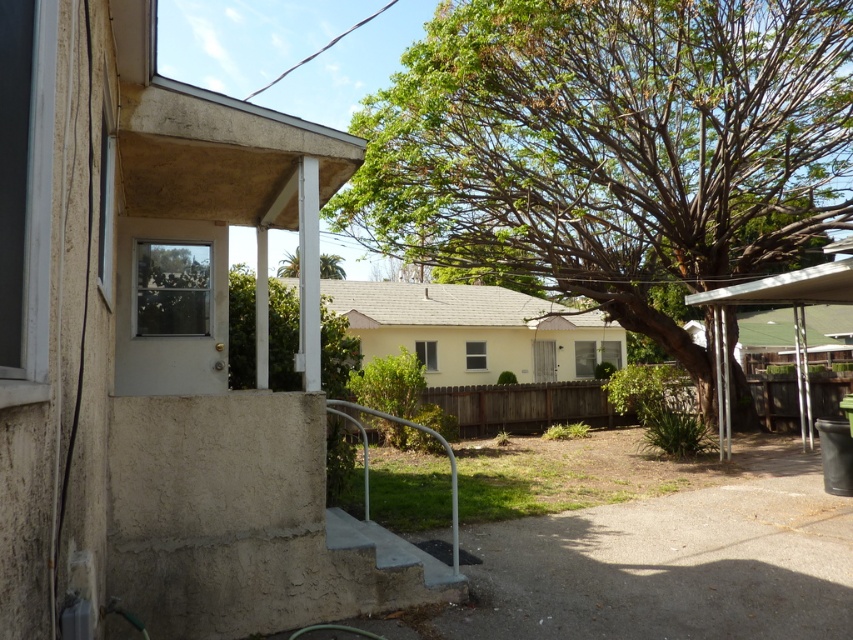
Looking at this image, you are planning to install a small garden between the green leafy tree at center and the green leafy tree at upper center. The garden requires a minimum of 10 meters of space between the two trees. Can you confirm if there is enough space for the garden?

The green leafy tree at center and green leafy tree at upper center are 12.23 meters apart from each other, which exceeds the required 10 meters. Therefore, there is sufficient space for the garden between them.